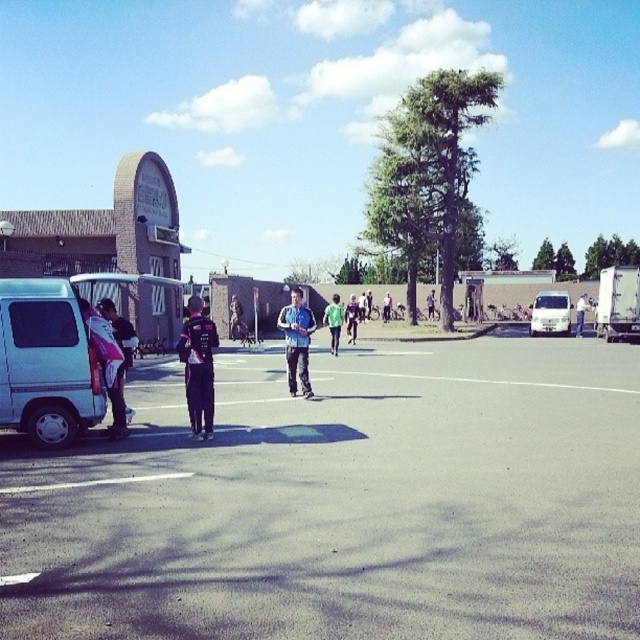
Who is lower down, pink fabric jacket at left or green fabric jacket at center?

pink fabric jacket at left is below.

Is pink fabric jacket at left shorter than green fabric jacket at center?

In fact, pink fabric jacket at left may be taller than green fabric jacket at center.

Does point (90, 333) come behind point (388, 310)?

No, it is in front of (388, 310).

In order to click on pink fabric jacket at left in this screenshot , I will do `click(108, 365)`.

Does dark blue fabric jacket at center come in front of blue fabric skateboarder at center?

Yes.

Is dark blue fabric jacket at center wider than blue fabric skateboarder at center?

Correct, the width of dark blue fabric jacket at center exceeds that of blue fabric skateboarder at center.

This screenshot has width=640, height=640. What do you see at coordinates (198, 365) in the screenshot?
I see `dark blue fabric jacket at center` at bounding box center [198, 365].

Locate an element on the screen. The height and width of the screenshot is (640, 640). dark blue fabric jacket at center is located at coordinates (198, 365).

Describe the element at coordinates (352, 317) in the screenshot. I see `light blue fabric jacket at center` at that location.

This screenshot has height=640, width=640. Identify the location of light blue fabric jacket at center. (352, 317).